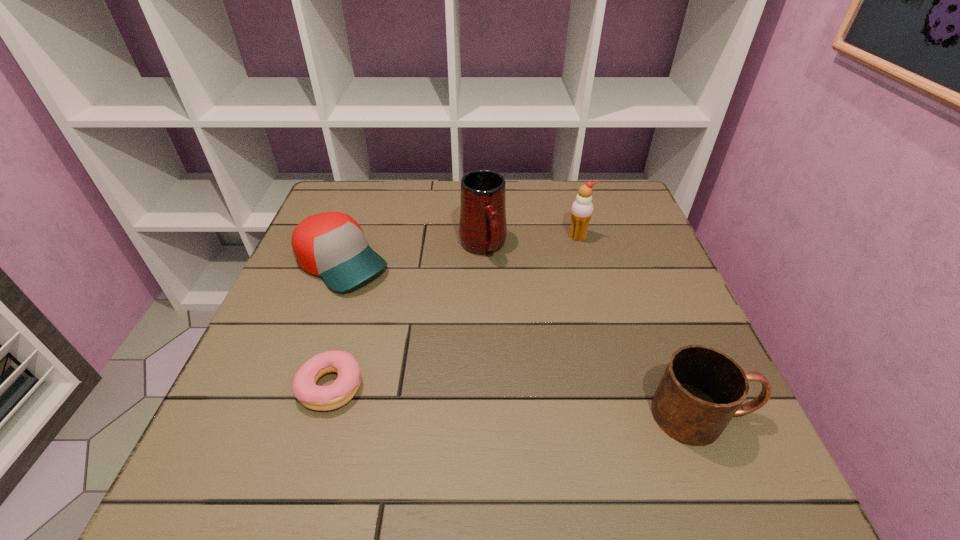
This screenshot has width=960, height=540. In order to click on vacant space at the far right corner in this screenshot , I will do `click(581, 183)`.

Identify the location of free space between the baseball cap and the rightmost object. (522, 339).

This screenshot has width=960, height=540. Identify the location of free point between the doughnut and the right mug. (517, 401).

The image size is (960, 540). Find the location of `vacant point located between the shorter mug and the farther mug`. vacant point located between the shorter mug and the farther mug is located at coordinates (593, 330).

At what (x,y) coordinates should I click in order to perform the action: click on free space between the doughnut and the third object from left to right. Please return your answer as a coordinate pair (x, y). This screenshot has width=960, height=540. Looking at the image, I should click on (407, 316).

The image size is (960, 540). Find the location of `free point between the shorter mug and the shortest object`. free point between the shorter mug and the shortest object is located at coordinates (517, 401).

Identify the location of free space that is in between the shorter mug and the baseball cap. click(x=522, y=339).

Find the location of a particular element. The width and height of the screenshot is (960, 540). free space that is in between the doughnut and the taller mug is located at coordinates (407, 316).

Locate an element on the screen. The width and height of the screenshot is (960, 540). vacant space that is in between the baseball cap and the icecream is located at coordinates (460, 250).

At what (x,y) coordinates should I click in order to perform the action: click on empty location between the shortest object and the icecream. Please return your answer as a coordinate pair (x, y). Looking at the image, I should click on (454, 312).